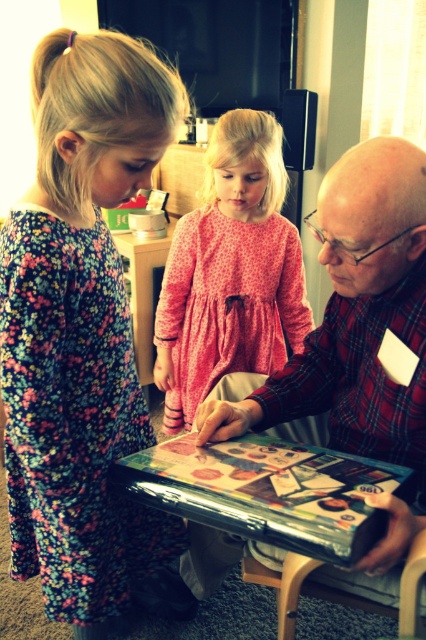
You are a parent trying to arrange two dresses in a closet. The floral dress at left and the pink dotted dress at center are to be placed side by side. Given that the closet shelf is 26 inches wide, will both dresses fit without overlapping?

The distance between the floral dress at left and pink dotted dress at center is 25.75 inches, so they can fit on the 26 inch shelf without overlapping since the total required space is slightly less than the available width.

In the living room scene, there are two girls wearing different dresses. The girl in the floral dress at left and the girl in the pink dotted dress at center. Which girl is standing taller?

The floral dress at left is much taller than the pink dotted dress at center, so the girl in the floral dress at left is standing taller.